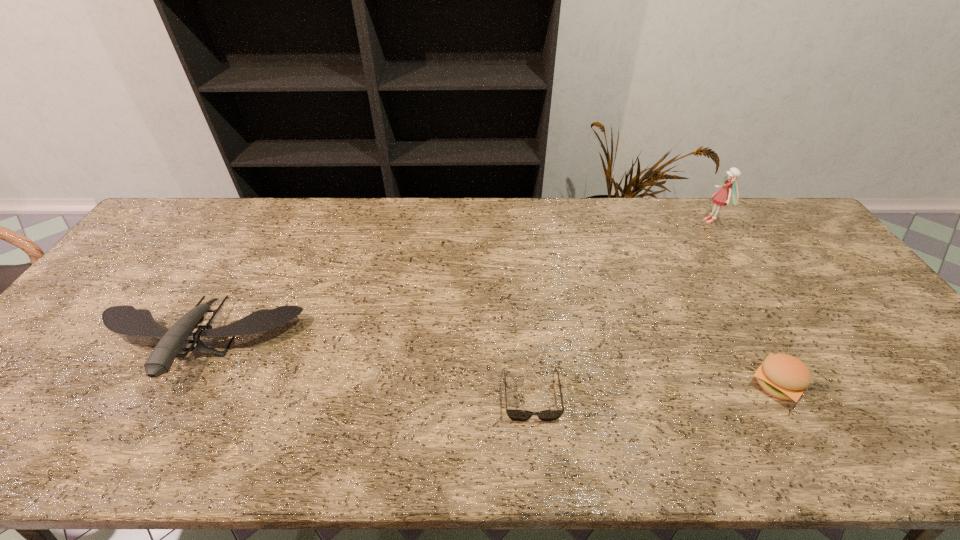
Locate an element on the screen. Image resolution: width=960 pixels, height=540 pixels. unoccupied area between the hamburger and the tallest object is located at coordinates (744, 302).

You are a GUI agent. You are given a task and a screenshot of the screen. Output one action in this format:
    pyautogui.click(x=<x>, y=<y>)
    Task: Click on the empty location between the second tallest object and the shortest object
    
    Given the screenshot: What is the action you would take?
    pyautogui.click(x=364, y=370)

You are a GUI agent. You are given a task and a screenshot of the screen. Output one action in this format:
    pyautogui.click(x=<x>, y=<y>)
    Task: Click on the vacant area between the hamburger and the shortest object
    The width and height of the screenshot is (960, 540).
    Given the screenshot: What is the action you would take?
    pyautogui.click(x=654, y=390)

Where is `empty space that is in between the shortest object and the leftmost object`? Image resolution: width=960 pixels, height=540 pixels. empty space that is in between the shortest object and the leftmost object is located at coordinates tap(364, 370).

Where is `free space between the sunglasses and the hamburger`? free space between the sunglasses and the hamburger is located at coordinates (654, 390).

Where is `free spot between the farthest object and the drone`? free spot between the farthest object and the drone is located at coordinates (454, 282).

At what (x,y) coordinates should I click in order to perform the action: click on free space between the shortest object and the hamburger. Please return your answer as a coordinate pair (x, y). This screenshot has width=960, height=540. Looking at the image, I should click on (654, 390).

Find the location of a particular element. free space between the farthest object and the shortest object is located at coordinates (622, 308).

Find the location of a particular element. This screenshot has height=540, width=960. free space that is in between the third object from right to left and the doll is located at coordinates point(622,308).

Locate an element on the screen. The width and height of the screenshot is (960, 540). the closest object to the doll is located at coordinates (783, 376).